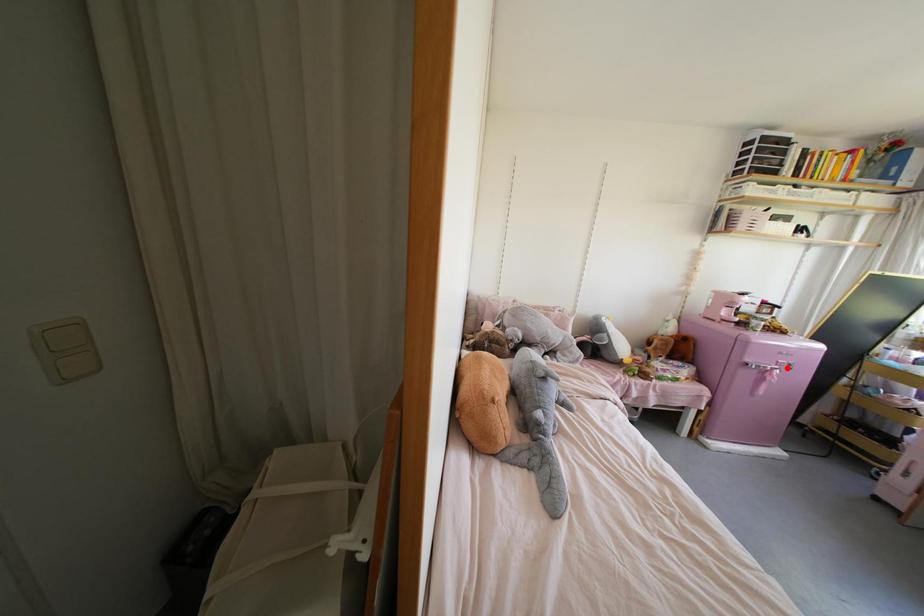
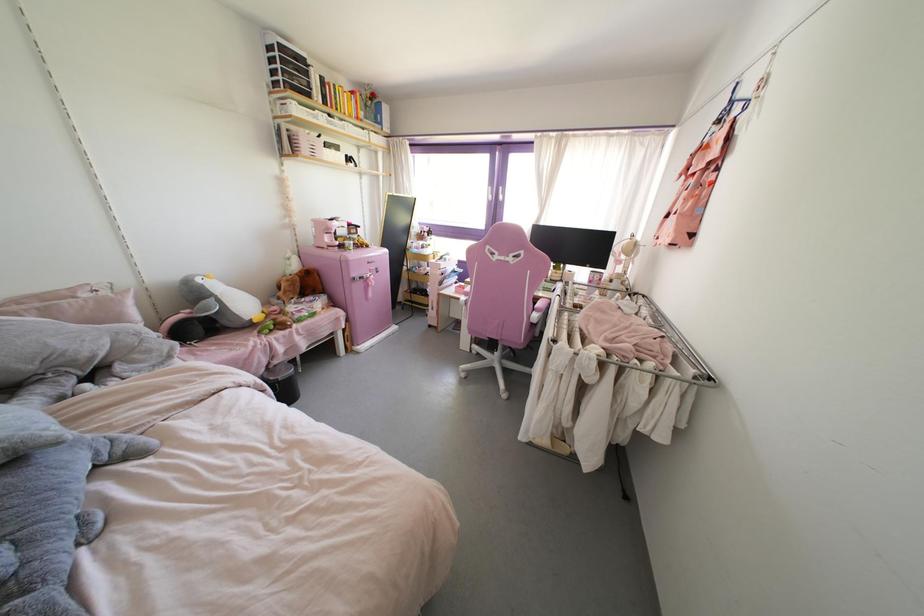
Question: A red point is marked in image1. In image2, is the corresponding 3D point closer to the camera or farther? Reply with the corresponding letter.

Choices:
 (A) The corresponding 3D point is closer.
 (B) The corresponding 3D point is farther.

Answer: (A)